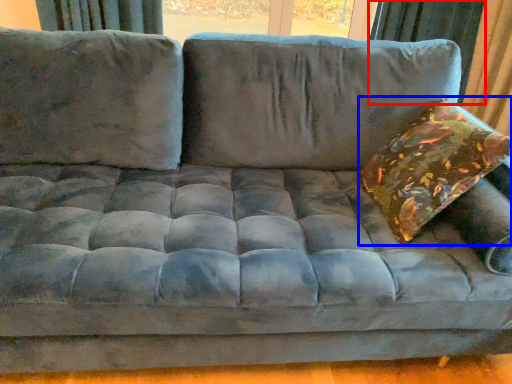
Question: Which of the following is the closest to the observer, curtain (highlighted by a red box) or throw pillow (highlighted by a blue box)?

Choices:
 (A) curtain
 (B) throw pillow

Answer: (B)